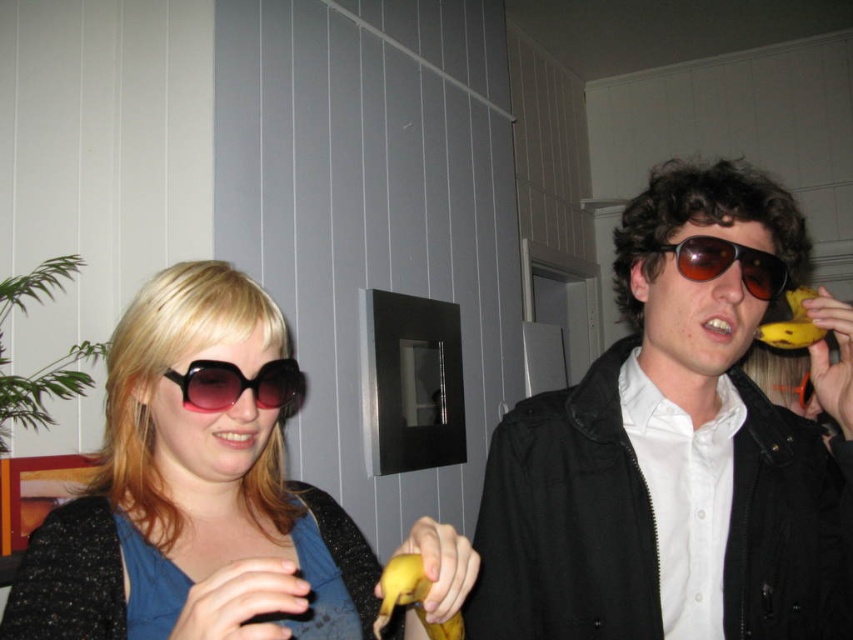
Question: Among these points, which one is farthest from the camera?

Choices:
 (A) tap(424, 586)
 (B) tap(482, 499)

Answer: (B)

Question: Can you confirm if matte black jacket at right is wider than yellow matte banana at lower center?

Choices:
 (A) no
 (B) yes

Answer: (B)

Question: Can you confirm if matte black sunglasses at left is wider than pink reflective sunglasses at left?

Choices:
 (A) no
 (B) yes

Answer: (B)

Question: Which point appears closest to the camera in this image?

Choices:
 (A) (329, 614)
 (B) (170, 376)
 (C) (631, 348)
 (D) (729, 256)

Answer: (B)

Question: Among these objects, which one is nearest to the camera?

Choices:
 (A) pink reflective sunglasses at left
 (B) matte black jacket at right

Answer: (A)

Question: Can you confirm if pink reflective sunglasses at left is smaller than brown reflective sunglasses at right?

Choices:
 (A) yes
 (B) no

Answer: (A)